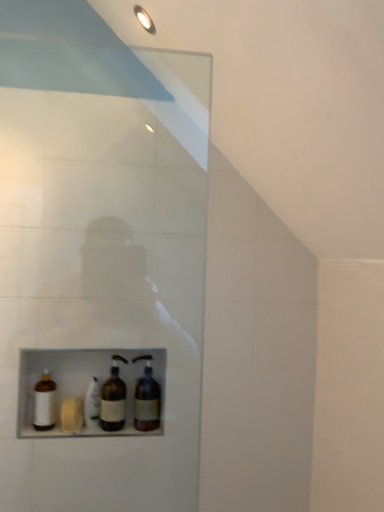
Question: From a real-world perspective, does white matte bottle at center, acting as the third bottle starting from the right, stand above white matte bottle at lower left, marked as the first bottle in a left-to-right arrangement?

Choices:
 (A) yes
 (B) no

Answer: (B)

Question: Is white matte bottle at lower left, marked as the first bottle in a left-to-right arrangement, a part of white matte bottle at center, acting as the third bottle starting from the right?

Choices:
 (A) yes
 (B) no

Answer: (B)

Question: From the image's perspective, is white matte bottle at center, acting as the third bottle starting from the right, above white matte bottle at lower left, marked as the first bottle in a left-to-right arrangement?

Choices:
 (A) yes
 (B) no

Answer: (B)

Question: Considering the relative sizes of white matte bottle at center, acting as the third bottle starting from the right, and white matte bottle at lower left, marked as the first bottle in a left-to-right arrangement, in the image provided, is white matte bottle at center, acting as the third bottle starting from the right, bigger than white matte bottle at lower left, marked as the first bottle in a left-to-right arrangement,?

Choices:
 (A) yes
 (B) no

Answer: (A)

Question: Does white matte bottle at center, the second bottle from the left, have a lesser height compared to white matte bottle at lower left, which is counted as the 4th bottle, starting from the right?

Choices:
 (A) yes
 (B) no

Answer: (B)

Question: From the image's perspective, is white matte bottle at center, the second bottle from the left, beneath white matte bottle at lower left, marked as the first bottle in a left-to-right arrangement?

Choices:
 (A) no
 (B) yes

Answer: (B)

Question: Is white matte bottle at lower left, which is counted as the 4th bottle, starting from the right, thinner than brown glass bottle at center, placed as the fourth bottle when sorted from left to right?

Choices:
 (A) no
 (B) yes

Answer: (B)

Question: Does white matte bottle at lower left, which is counted as the 4th bottle, starting from the right, touch brown glass bottle at center, which ranks as the first bottle in right-to-left order?

Choices:
 (A) no
 (B) yes

Answer: (A)

Question: Is white matte bottle at lower left, marked as the first bottle in a left-to-right arrangement, far away from brown glass bottle at center, which ranks as the first bottle in right-to-left order?

Choices:
 (A) no
 (B) yes

Answer: (A)

Question: From a real-world perspective, is white matte bottle at lower left, which is counted as the 4th bottle, starting from the right, beneath brown glass bottle at center, which ranks as the first bottle in right-to-left order?

Choices:
 (A) no
 (B) yes

Answer: (B)

Question: Can you confirm if white matte bottle at lower left, marked as the first bottle in a left-to-right arrangement, is positioned to the right of brown glass bottle at center, placed as the fourth bottle when sorted from left to right?

Choices:
 (A) yes
 (B) no

Answer: (B)

Question: Does white matte bottle at lower left, marked as the first bottle in a left-to-right arrangement, have a larger size compared to brown glass bottle at center, placed as the fourth bottle when sorted from left to right?

Choices:
 (A) no
 (B) yes

Answer: (A)

Question: From a real-world perspective, does white matte bottle at center, acting as the third bottle starting from the right, stand above brown glass bottle at center, which appears as the second bottle when viewed from the right?

Choices:
 (A) yes
 (B) no

Answer: (B)